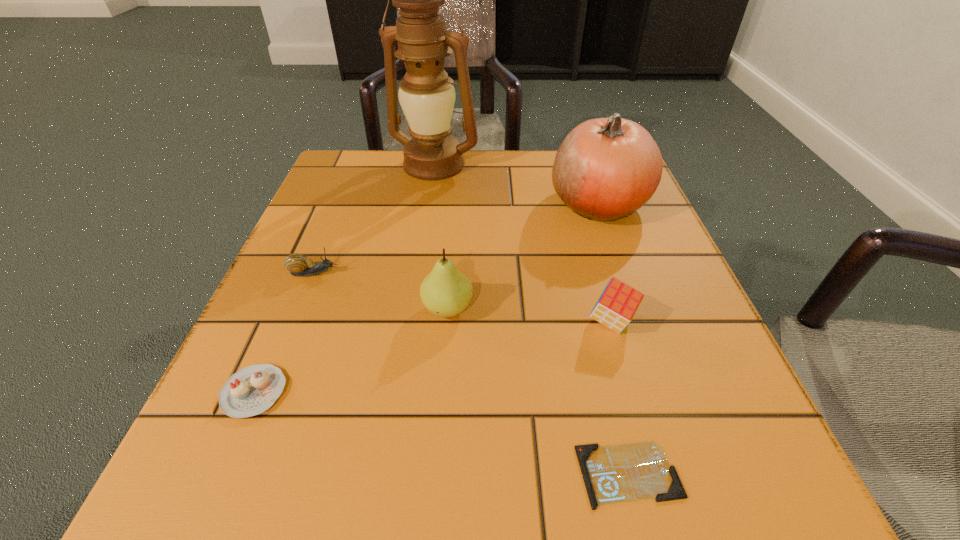
The height and width of the screenshot is (540, 960). I want to click on vacant region at the near edge of the desktop, so click(x=466, y=463).

Image resolution: width=960 pixels, height=540 pixels. In order to click on vacant space at the left edge in this screenshot , I will do `click(330, 221)`.

This screenshot has height=540, width=960. Identify the location of free spot at the right edge of the desktop. (618, 219).

Identify the location of vacant area at the far left corner of the desktop. The width and height of the screenshot is (960, 540). (369, 204).

At what (x,y) coordinates should I click in order to perform the action: click on vacant space at the near right corner of the desktop. Please return your answer as a coordinate pair (x, y). This screenshot has height=540, width=960. Looking at the image, I should click on (722, 442).

This screenshot has width=960, height=540. What are the coordinates of `free space between the cube and the oil lamp` in the screenshot? It's located at (523, 244).

Find the location of a particular element. Image resolution: width=960 pixels, height=540 pixels. vacant area that lies between the shortest object and the escargot is located at coordinates (471, 374).

Locate an element on the screen. This screenshot has height=540, width=960. vacant point located between the third shortest object and the tallest object is located at coordinates (374, 219).

This screenshot has width=960, height=540. Identify the location of free point between the cupcake and the fifth shortest object. (350, 350).

The height and width of the screenshot is (540, 960). In order to click on vacant region between the second tallest object and the pear in this screenshot , I will do `click(523, 256)`.